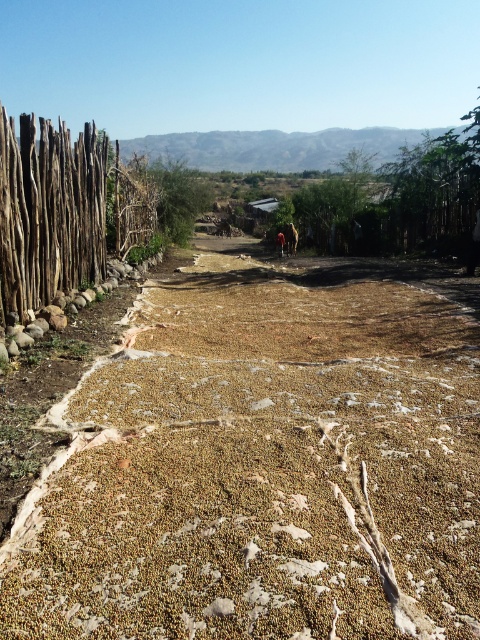
Looking at this image, you are a farmer who wants to plant new crops in the brown rough dirt field at center and the green leafy tree at center. Which area has more space available for planting?

The green leafy tree at center occupies more space than the brown rough dirt field at center, so the green leafy tree at center has more space available for planting.

You are standing at the point labeled as point (263, 460) in the image. What type of surface are you currently standing on?

You are standing on the brown rough dirt field at center.